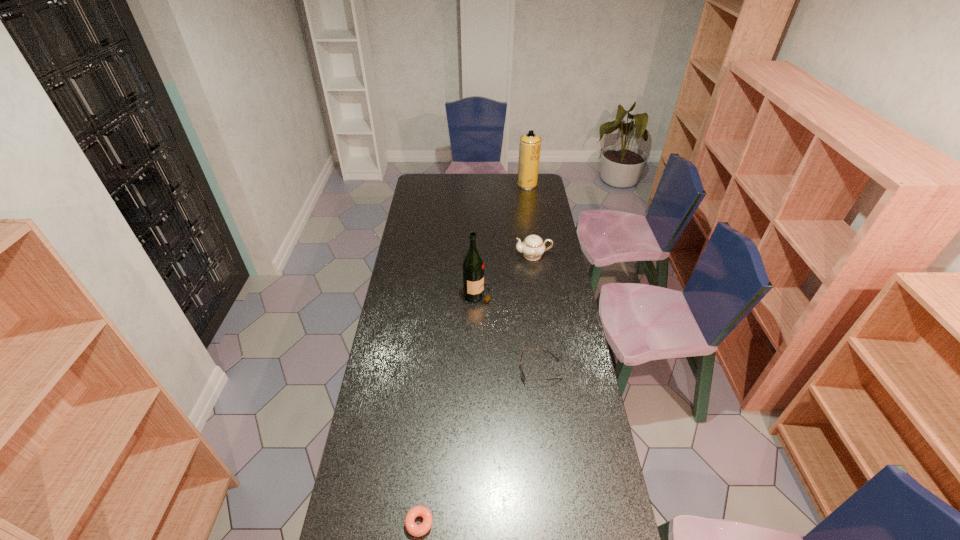
Where is `the farthest object`? This screenshot has height=540, width=960. the farthest object is located at coordinates (529, 150).

You are a GUI agent. You are given a task and a screenshot of the screen. Output one action in this format:
    pyautogui.click(x=<x>, y=<y>)
    Task: Click on the second object from left to right
    
    Given the screenshot: What is the action you would take?
    pyautogui.click(x=473, y=265)

Where is `the third nearest object`? the third nearest object is located at coordinates (473, 265).

This screenshot has height=540, width=960. Identify the location of the fourth nearest object. (532, 247).

You are a GUI agent. You are given a task and a screenshot of the screen. Output one action in this format:
    pyautogui.click(x=<x>, y=<y>)
    Task: Click on the third shortest object
    
    Given the screenshot: What is the action you would take?
    [532, 247]

In order to click on the fourth tallest object in this screenshot , I will do `click(521, 370)`.

This screenshot has width=960, height=540. Find the location of `sunglasses`. sunglasses is located at coordinates (521, 370).

Locate an element on the screen. This screenshot has width=960, height=540. doughnut is located at coordinates (415, 530).

Image resolution: width=960 pixels, height=540 pixels. In order to click on the shortest object in this screenshot , I will do `click(415, 530)`.

What are the coordinates of `vacant space located on the right of the aerosol can` in the screenshot? It's located at (545, 184).